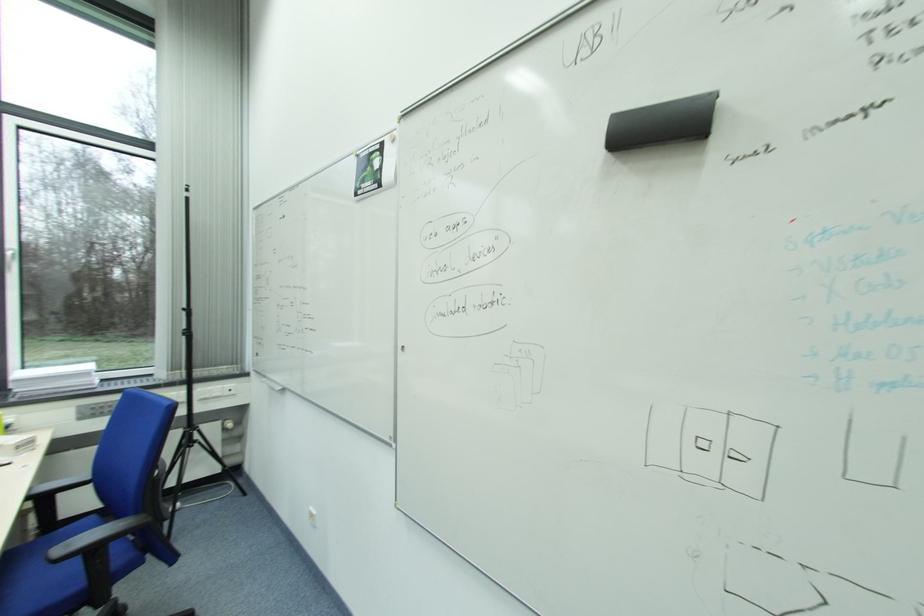
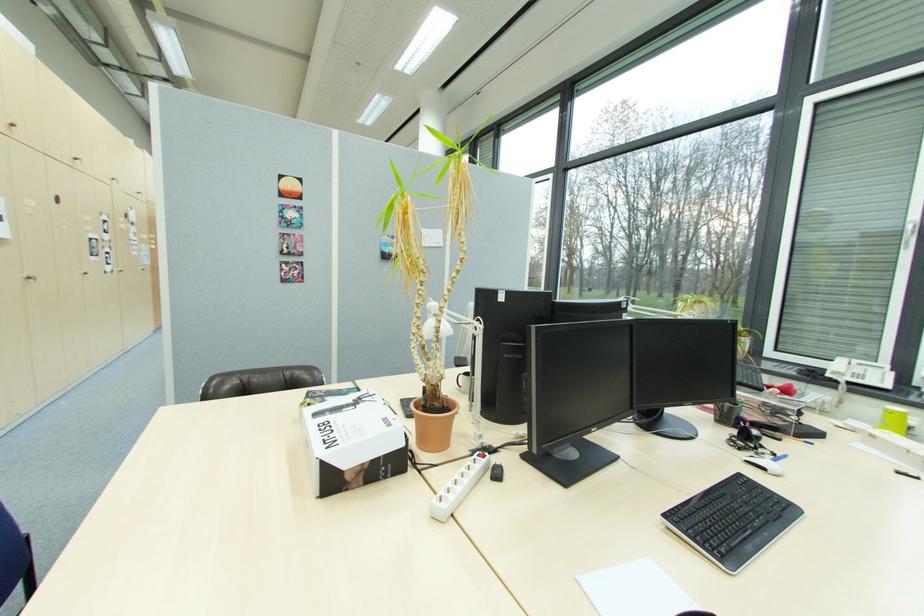
Question: The images are taken continuously from a first-person perspective. In which direction is your viewpoint rotating?

Choices:
 (A) Left
 (B) Right
 (C) Up
 (D) Down

Answer: (A)